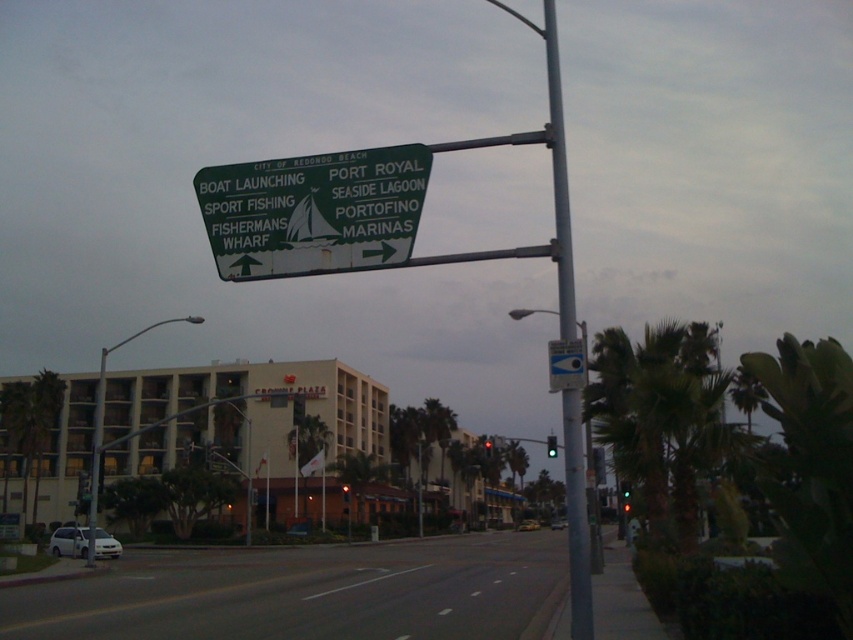
Question: Which is nearer to the green leafy palm tree at left?

Choices:
 (A) metallic pole at left
 (B) green leafy palm tree at center
 (C) red glass traffic light at center
 (D) green glass traffic light at upper center

Answer: (A)

Question: Which point is farther from the camera taking this photo?

Choices:
 (A) (648, 445)
 (B) (344, 486)

Answer: (B)

Question: Is green leafy palm tree at center in front of green glass street light at center?

Choices:
 (A) yes
 (B) no

Answer: (B)

Question: Which object appears closest to the camera in this image?

Choices:
 (A) white plastic parking sign at upper center
 (B) green leafy palm tree at left
 (C) white matte car at center

Answer: (A)

Question: Can you confirm if green leafy palm tree at center is smaller than metallic pole at left?

Choices:
 (A) yes
 (B) no

Answer: (A)

Question: Can you confirm if green leafy palm tree at center is wider than metallic pole at left?

Choices:
 (A) no
 (B) yes

Answer: (A)